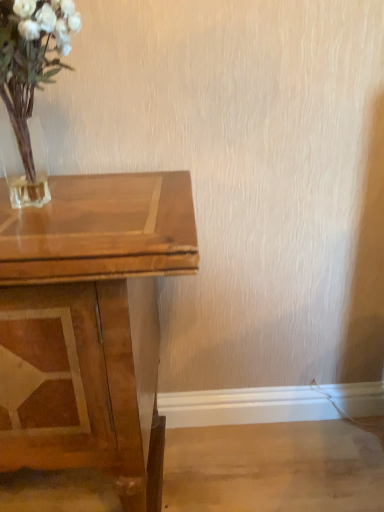
Question: Should I look upward or downward to see shiny brown wooden table at left?

Choices:
 (A) up
 (B) down

Answer: (B)

Question: Can you see shiny brown wooden table at left touching translucent glass vase at upper left?

Choices:
 (A) no
 (B) yes

Answer: (A)

Question: Can you confirm if shiny brown wooden table at left is taller than translucent glass vase at upper left?

Choices:
 (A) yes
 (B) no

Answer: (A)

Question: Is translucent glass vase at upper left at the back of shiny brown wooden table at left?

Choices:
 (A) no
 (B) yes

Answer: (A)

Question: From a real-world perspective, is shiny brown wooden table at left located higher than translucent glass vase at upper left?

Choices:
 (A) yes
 (B) no

Answer: (B)

Question: Is shiny brown wooden table at left outside of translucent glass vase at upper left?

Choices:
 (A) yes
 (B) no

Answer: (A)

Question: Is shiny brown wooden table at left far away from translucent glass vase at upper left?

Choices:
 (A) no
 (B) yes

Answer: (A)

Question: Could you tell me if translucent glass vase at upper left is facing shiny brown wooden table at left?

Choices:
 (A) no
 (B) yes

Answer: (A)

Question: Does translucent glass vase at upper left have a greater height compared to shiny brown wooden table at left?

Choices:
 (A) yes
 (B) no

Answer: (B)

Question: Would you consider translucent glass vase at upper left to be distant from shiny brown wooden table at left?

Choices:
 (A) no
 (B) yes

Answer: (A)

Question: Is translucent glass vase at upper left at the left side of shiny brown wooden table at left?

Choices:
 (A) yes
 (B) no

Answer: (B)

Question: Is shiny brown wooden table at left a part of translucent glass vase at upper left?

Choices:
 (A) yes
 (B) no

Answer: (B)

Question: Can you confirm if translucent glass vase at upper left is positioned to the right of shiny brown wooden table at left?

Choices:
 (A) no
 (B) yes

Answer: (B)

Question: In terms of height, does shiny brown wooden table at left look taller or shorter compared to translucent glass vase at upper left?

Choices:
 (A) tall
 (B) short

Answer: (A)